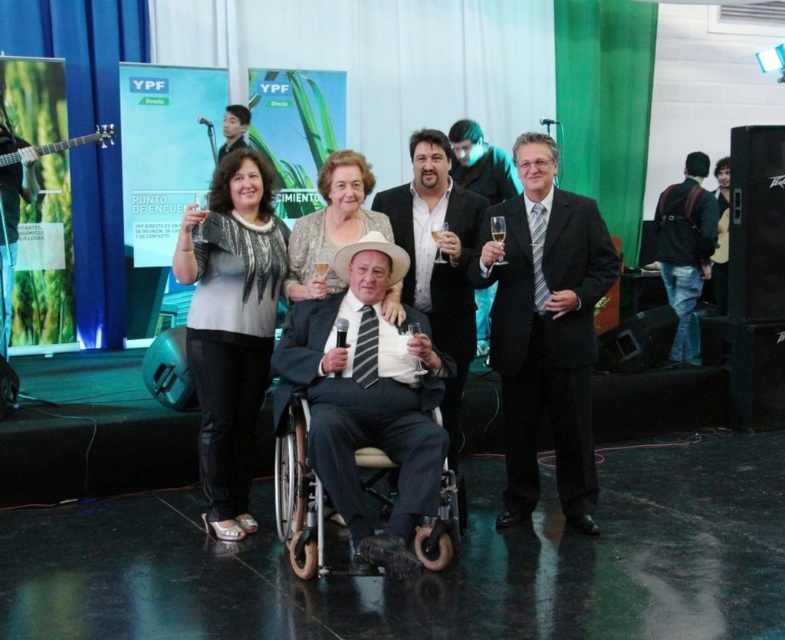
Looking at this image, based on the scene description, where is the matte black suit at upper center located in terms of coordinates?

The matte black suit at upper center is located at point coordinates of 0.202 on the x axis and 0.298 on the y axis.

You are a photographer at the event and need to capture a closeup of the matte white hat at center and the clear glass champagne flute at center. Which object should you zoom in on more to ensure both are in focus?

The matte white hat at center is larger in size compared to the clear glass champagne flute at center, so you should zoom in more on the hat to ensure both are in focus.

You are at point (331, 225). What object is located at this point?

The matte white hat at center is located at point (331, 225).